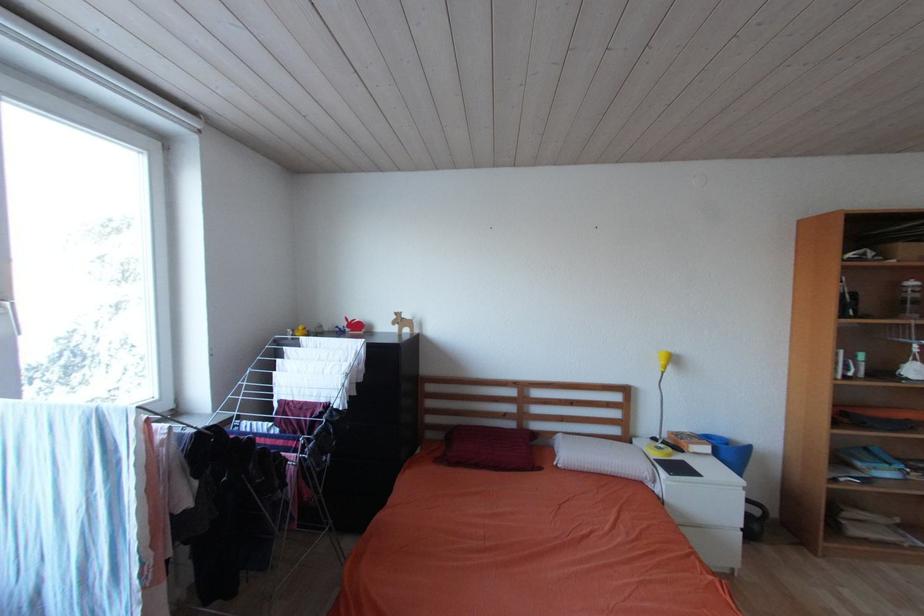
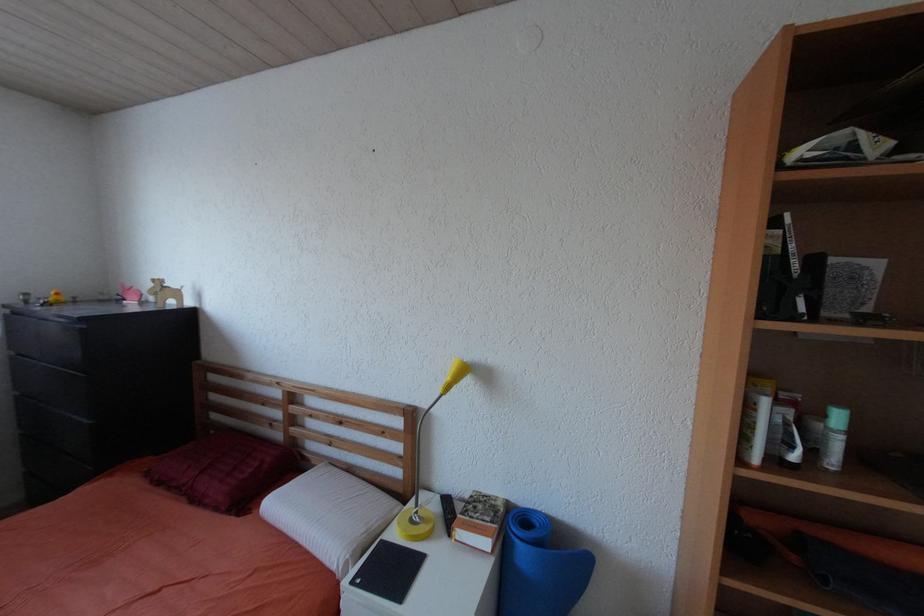
The images are taken continuously from a first-person perspective. In which direction are you moving?

The cameraman moved toward right, forward.